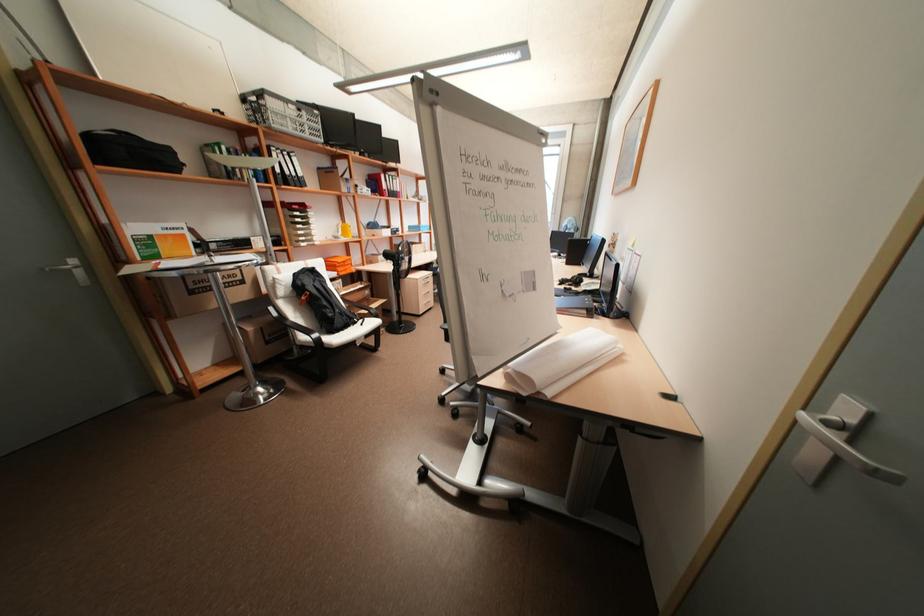
Locate an element on the screen. The width and height of the screenshot is (924, 616). rolled white paper is located at coordinates (561, 362).